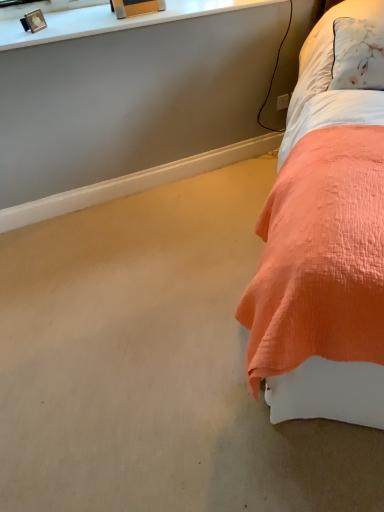
Question: Considering the relative sizes of coral quilted bed at right and white plastic power outlet at upper right in the image provided, is coral quilted bed at right thinner than white plastic power outlet at upper right?

Choices:
 (A) yes
 (B) no

Answer: (B)

Question: From a real-world perspective, is coral quilted bed at right located beneath white plastic power outlet at upper right?

Choices:
 (A) no
 (B) yes

Answer: (A)

Question: Is coral quilted bed at right turned away from white plastic power outlet at upper right?

Choices:
 (A) no
 (B) yes

Answer: (A)

Question: Is coral quilted bed at right further to the viewer compared to white plastic power outlet at upper right?

Choices:
 (A) no
 (B) yes

Answer: (A)

Question: Would you say coral quilted bed at right contains white plastic power outlet at upper right?

Choices:
 (A) no
 (B) yes

Answer: (A)

Question: Can you confirm if coral quilted bed at right is bigger than white plastic power outlet at upper right?

Choices:
 (A) no
 (B) yes

Answer: (B)

Question: Is metallic gold picture frame at upper left shorter than coral quilted bed at right?

Choices:
 (A) no
 (B) yes

Answer: (B)

Question: From a real-world perspective, is metallic gold picture frame at upper left located beneath coral quilted bed at right?

Choices:
 (A) no
 (B) yes

Answer: (A)

Question: Does metallic gold picture frame at upper left have a lesser width compared to coral quilted bed at right?

Choices:
 (A) no
 (B) yes

Answer: (B)

Question: Is the position of metallic gold picture frame at upper left less distant than that of coral quilted bed at right?

Choices:
 (A) no
 (B) yes

Answer: (A)

Question: Is metallic gold picture frame at upper left oriented towards coral quilted bed at right?

Choices:
 (A) yes
 (B) no

Answer: (A)

Question: Is metallic gold picture frame at upper left positioned behind coral quilted bed at right?

Choices:
 (A) no
 (B) yes

Answer: (B)

Question: Is coral quilted bed at right turned away from metallic gold picture frame at upper left?

Choices:
 (A) no
 (B) yes

Answer: (A)